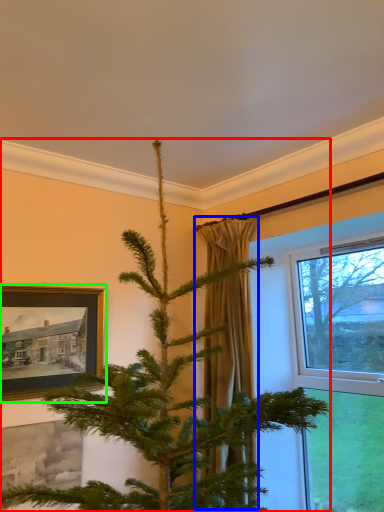
Question: Estimate the real-world distances between objects in this image. Which object is farther from christmas tree (highlighted by a red box), curtain (highlighted by a blue box) or picture frame (highlighted by a green box)?

Choices:
 (A) curtain
 (B) picture frame

Answer: (B)